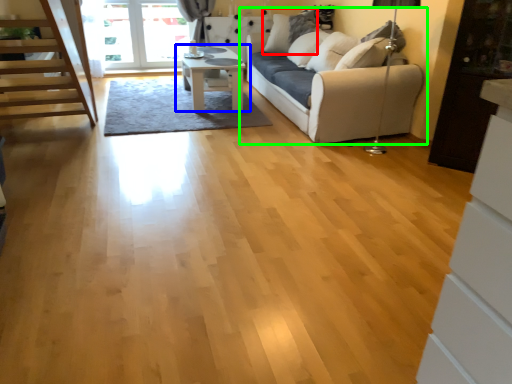
Question: Estimate the real-world distances between objects in this image. Which object is farther from pillow (highlighted by a red box), table (highlighted by a blue box) or studio couch (highlighted by a green box)?

Choices:
 (A) table
 (B) studio couch

Answer: (A)